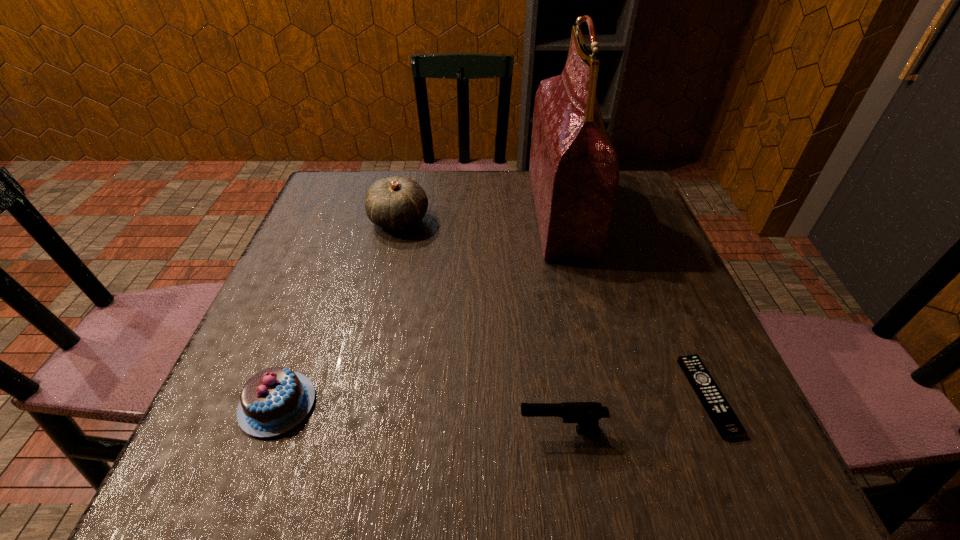
You are a GUI agent. You are given a task and a screenshot of the screen. Output one action in this format:
    pyautogui.click(x=<x>, y=<y>)
    Task: Click on the blank region between the shortest object and the gourd
    
    Given the screenshot: What is the action you would take?
    pyautogui.click(x=554, y=308)

This screenshot has height=540, width=960. Identify the location of empty space that is in between the gourd and the rightmost object. (554, 308).

Where is `free space between the chocolate cake and the rightmost object`? free space between the chocolate cake and the rightmost object is located at coordinates (492, 400).

Identify which object is the third nearest to the tallest object. Please provide its 2D coordinates. Your answer should be formatted as a tuple, i.e. [(x, y)], where the tuple contains the x and y coordinates of a point satisfying the conditions above.

[(586, 414)]

Locate an element on the screen. The image size is (960, 540). object that is the second closest to the chocolate cake is located at coordinates (396, 203).

Identify the location of free location that satisfies the following two spatial constraints: 1. on the back side of the chocolate cake; 2. on the right side of the rightmost object. Image resolution: width=960 pixels, height=540 pixels. point(281,396).

Locate an element on the screen. Image resolution: width=960 pixels, height=540 pixels. vacant position in the image that satisfies the following two spatial constraints: 1. on the front side of the gourd; 2. on the left side of the remote control is located at coordinates (359, 396).

Locate an element on the screen. vacant region that satisfies the following two spatial constraints: 1. on the front-facing side of the handbag; 2. on the right side of the remote control is located at coordinates (602, 396).